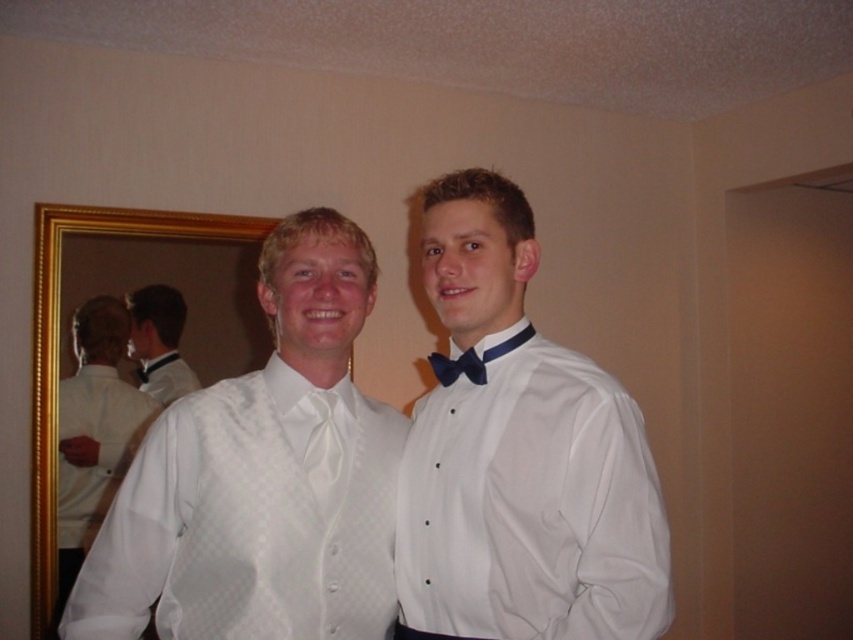
Does white satin shirt at center have a greater height compared to gold-framed mirror at left?

No, white satin shirt at center is not taller than gold-framed mirror at left.

Find the location of a particular element. Image resolution: width=853 pixels, height=640 pixels. white satin shirt at center is located at coordinates (247, 522).

At what (x,y) coordinates should I click in order to perform the action: click on white satin shirt at center. Please return your answer as a coordinate pair (x, y). Image resolution: width=853 pixels, height=640 pixels. Looking at the image, I should click on (247, 522).

Can you confirm if gold-framed mirror at left is positioned to the right of white satin bow tie at center?

In fact, gold-framed mirror at left is to the left of white satin bow tie at center.

Measure the distance between point (48, 253) and camera.

Point (48, 253) is 8.18 feet away from camera.

Is point (235, 301) positioned after point (329, 452)?

That is True.

Where is `gold-framed mirror at left`? gold-framed mirror at left is located at coordinates (122, 298).

Between matte white shirt at center and white satin shirt at left, which one appears on the left side from the viewer's perspective?

white satin shirt at left is more to the left.

Between point (422, 520) and point (86, 449), which one is positioned behind?

Positioned behind is point (86, 449).

Where is `matte white shirt at center`? matte white shirt at center is located at coordinates (519, 456).